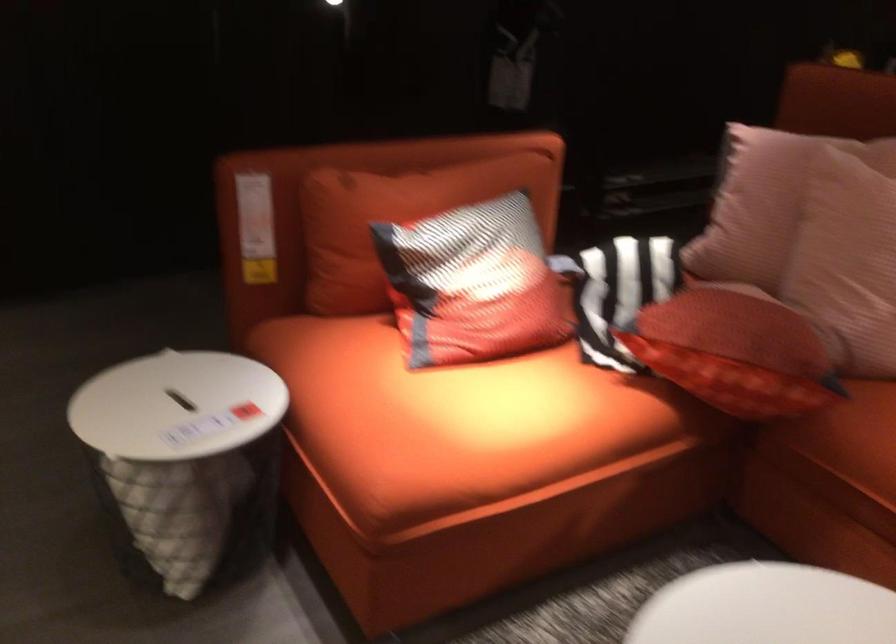
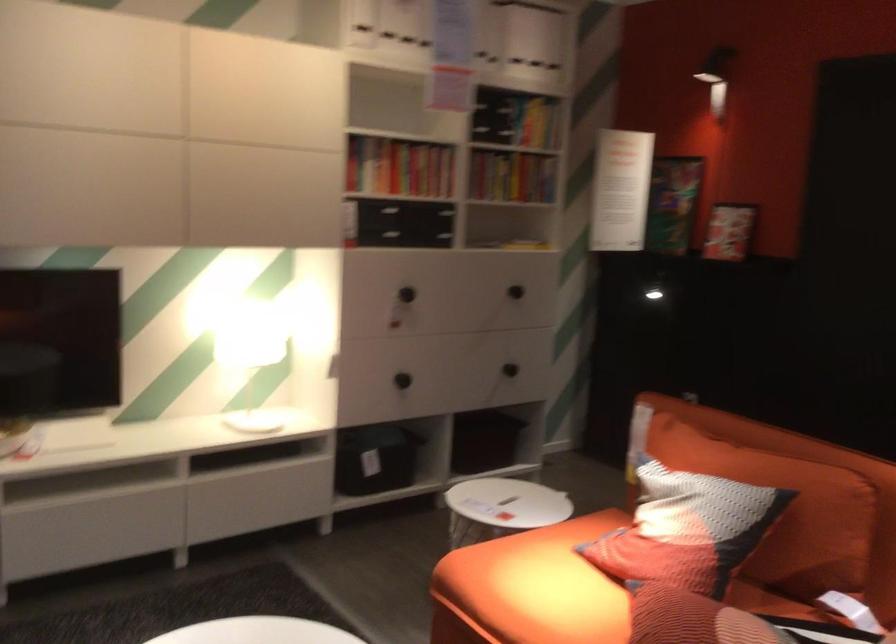
Locate, in the second image, the point that corresponds to the point at 532,270 in the first image.

(686, 529)